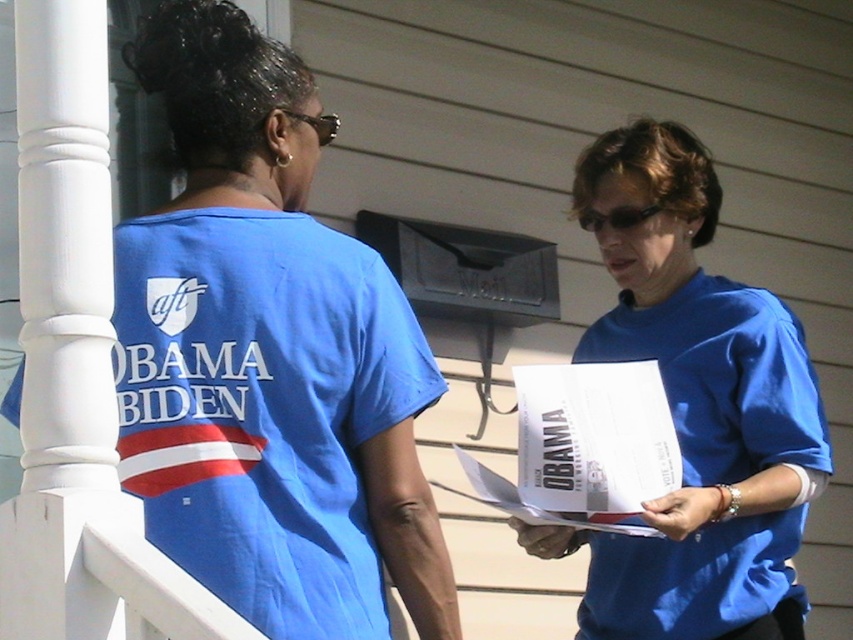
Does blue fabric t-shirt at upper left appear over blue fabric shirt at center?

Incorrect, blue fabric t-shirt at upper left is not positioned above blue fabric shirt at center.

Which is behind, point (263, 433) or point (811, 499)?

Positioned behind is point (811, 499).

I want to click on blue fabric t-shirt at upper left, so click(263, 406).